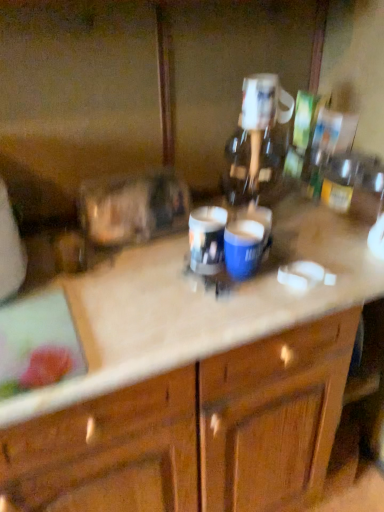
Identify the location of free space to the left of blue glossy mug at center, the 2th beverage from the left. (154, 278).